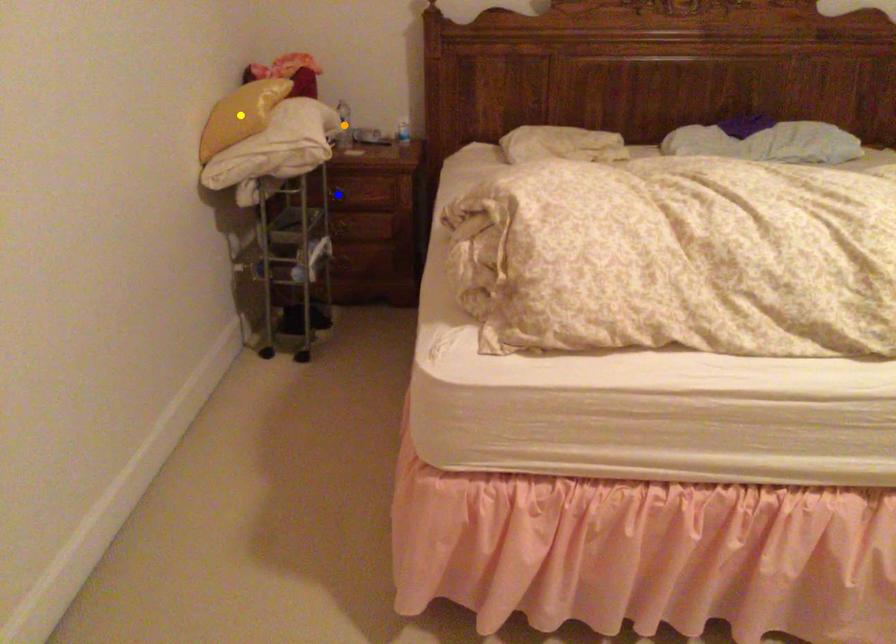
Order these from nearest to farthest:
blue point | yellow point | orange point

yellow point < blue point < orange point